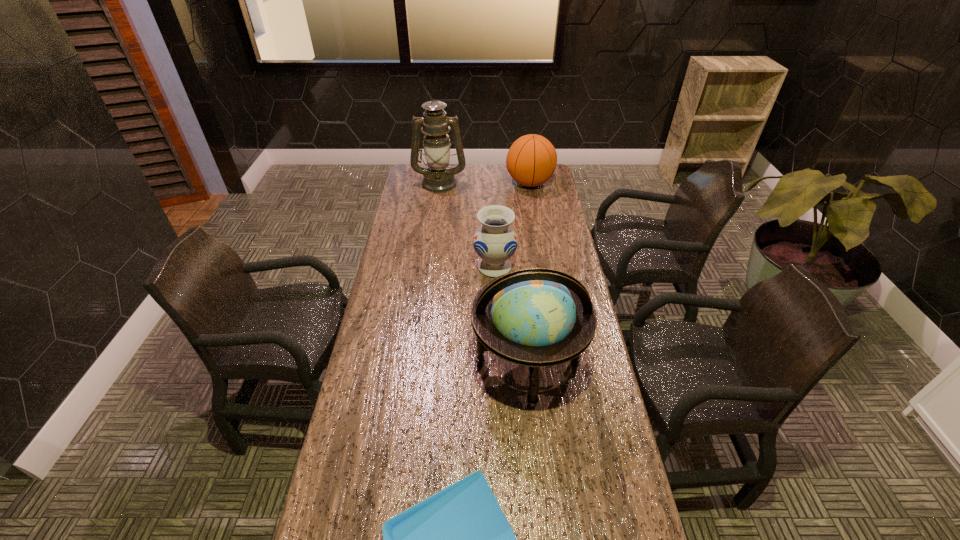
Identify the location of empty space between the basketball and the third farthest object. The height and width of the screenshot is (540, 960). (513, 225).

Locate which object ranks in proximity to the vase. Please provide its 2D coordinates. Your answer should be formatted as a tuple, i.e. [(x, y)], where the tuple contains the x and y coordinates of a point satisfying the conditions above.

[(538, 317)]

This screenshot has width=960, height=540. Identify the location of object that is the third closest to the oil lamp. (538, 317).